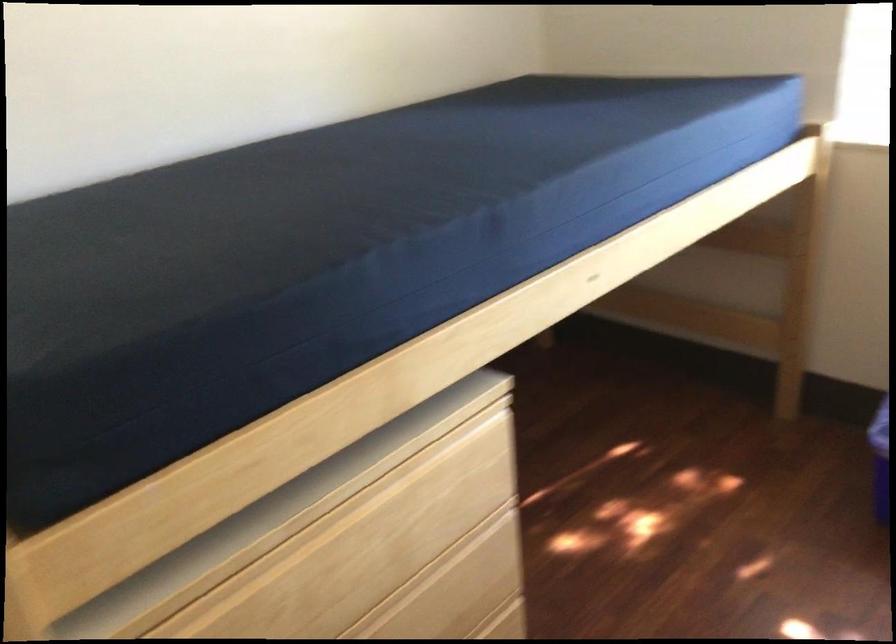
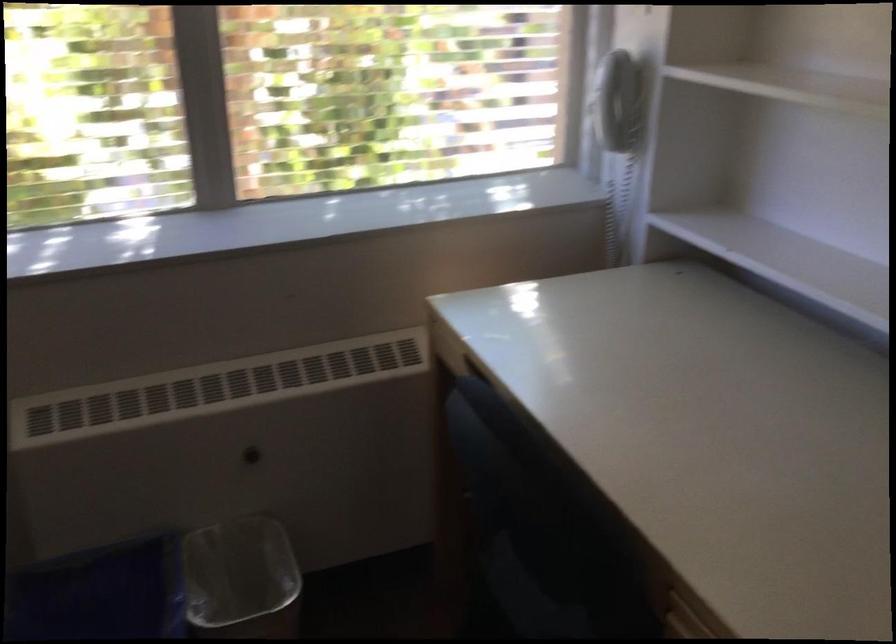
Question: How did the camera likely rotate?

Choices:
 (A) Left
 (B) Right
 (C) Up
 (D) Down

Answer: (B)